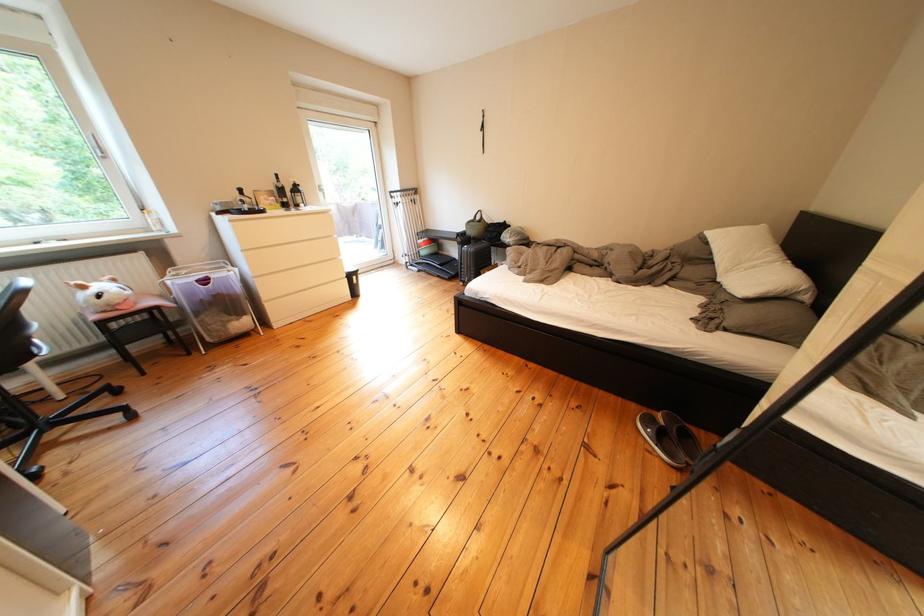
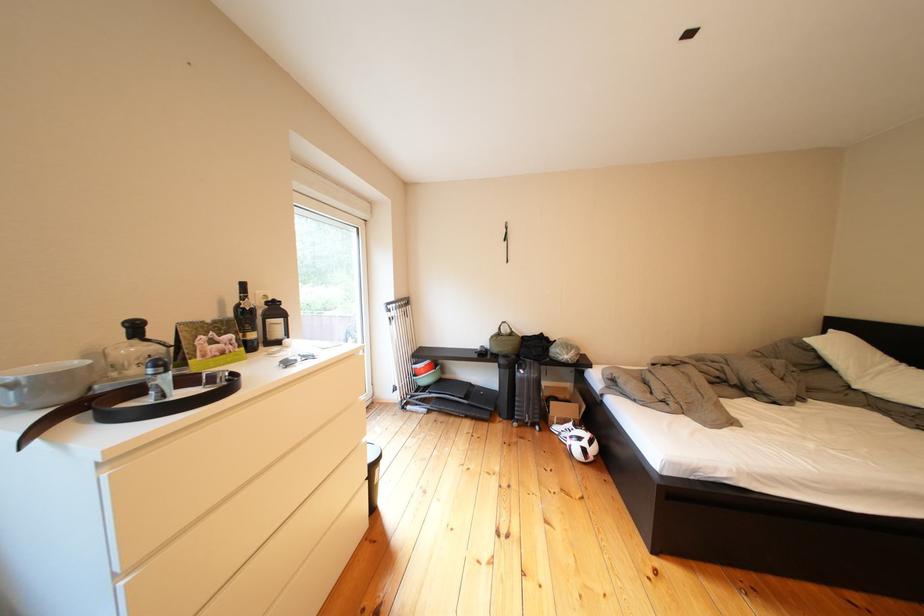
Find the pixel in the second image that matches (x=458, y=257) in the first image.

(462, 381)